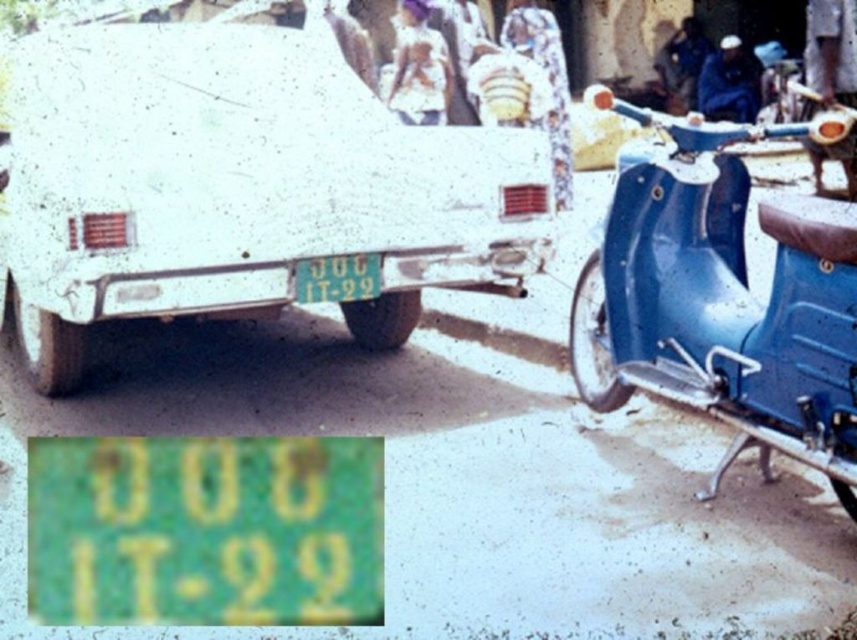
You are a delivery person trying to park your delivery van next to the white matte car at center and the green matte license plate at center. Which object should you avoid hitting because it is wider?

The white matte car at center is wider than the green matte license plate at center, so you should avoid hitting the white matte car at center.